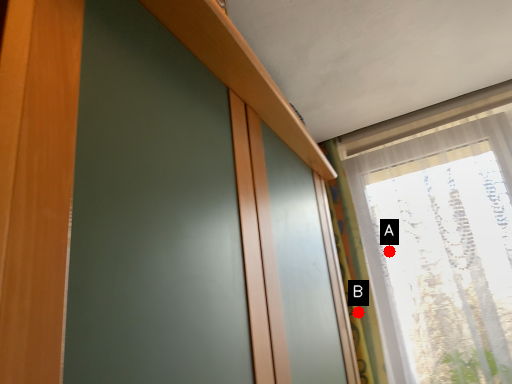
Question: Two points are circled on the image, labeled by A and B beside each circle. Which point is further to the camera?

Choices:
 (A) A is further
 (B) B is further

Answer: (A)